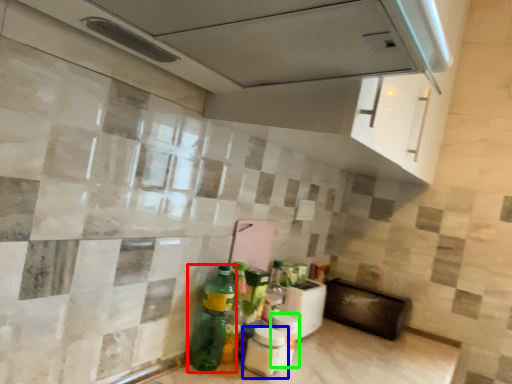
Question: Which object is the closest to the bottle (highlighted by a red box)? Choose among these: bottle (highlighted by a blue box) or bottle (highlighted by a green box).

Choices:
 (A) bottle
 (B) bottle

Answer: (A)